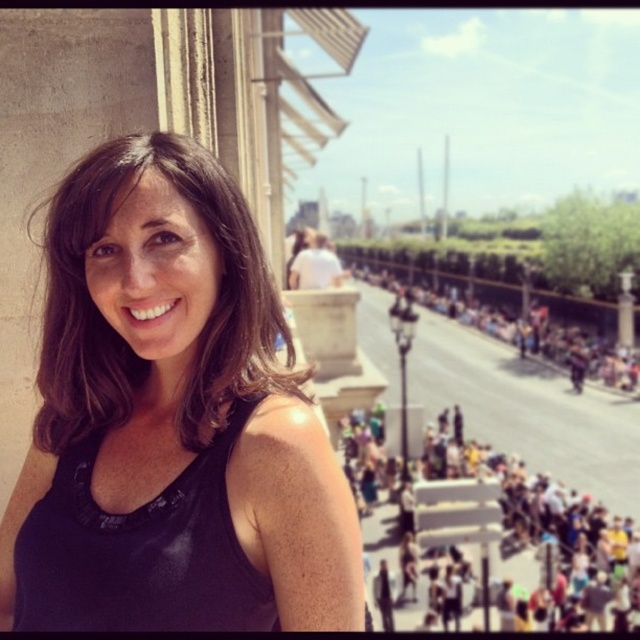
What are the coordinates of the dark brown hair at center?

The coordinates of the dark brown hair at center are (116, 330).

You are standing on a balcony and want to take a photo of the dark brown hair at center and the multicolored fabric crowd at lower right. Which object is closer to the camera?

The dark brown hair at center is closer to the camera than the multicolored fabric crowd at lower right because it is not as tall as the crowd, indicating it is in the foreground.

You are a photographer standing on a balcony and want to capture a photo of the dark brown hair at center and the dark gray concrete crowd at center. Based on their positions, which object should you focus on first to ensure both are in clear view?

The dark brown hair at center is to the left of dark gray concrete crowd at center, so you should focus on the dark brown hair at center first to ensure both are in clear view.